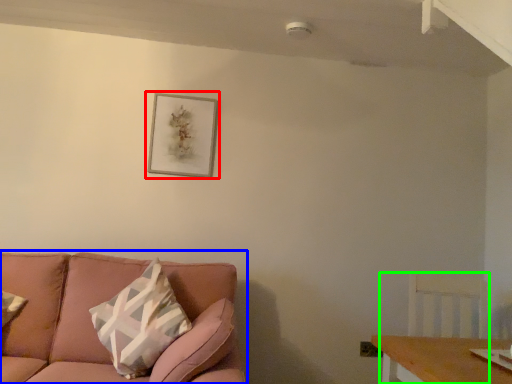
Question: Which object is positioned farthest from picture frame (highlighted by a red box)? Select from studio couch (highlighted by a blue box) and swivel chair (highlighted by a green box).

Choices:
 (A) studio couch
 (B) swivel chair

Answer: (B)